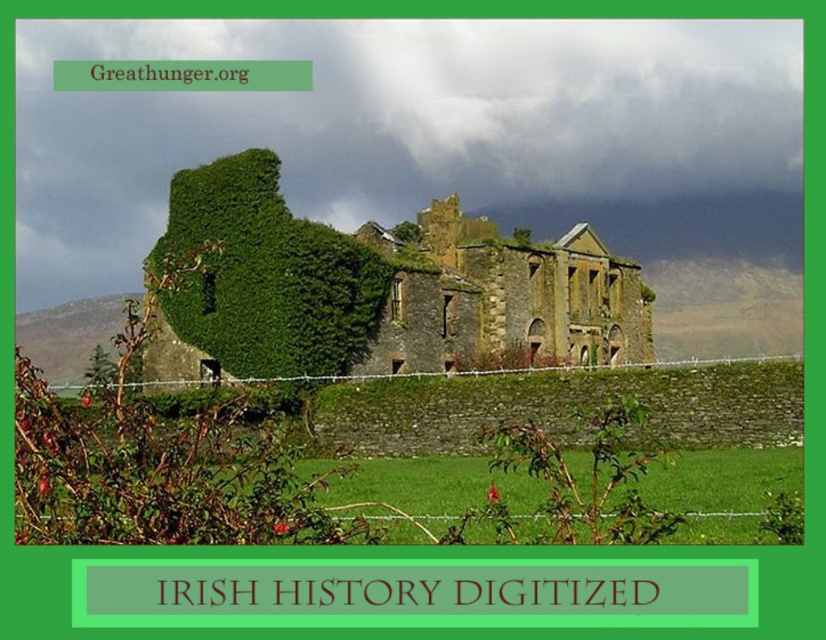
Question: Is green mossy stone building at center to the left of stone wall at center from the viewer's perspective?

Choices:
 (A) yes
 (B) no

Answer: (A)

Question: Which point is farther from the camera taking this photo?

Choices:
 (A) (146, 352)
 (B) (603, 278)

Answer: (B)

Question: Does green mossy stone building at center appear on the right side of stone wall at center?

Choices:
 (A) no
 (B) yes

Answer: (A)

Question: Among these points, which one is farthest from the camera?

Choices:
 (A) (483, 280)
 (B) (298, 268)

Answer: (A)

Question: Which of the following is the farthest from the observer?

Choices:
 (A) stone wall at center
 (B) green mossy stone building at center

Answer: (A)

Question: Is green mossy stone building at center to the right of stone wall at center from the viewer's perspective?

Choices:
 (A) yes
 (B) no

Answer: (B)